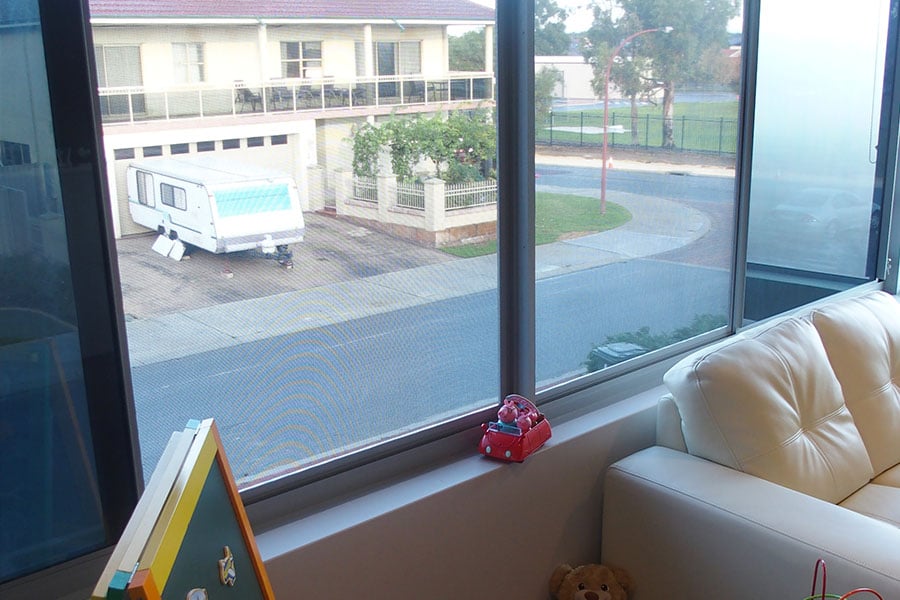
Where is `chalkboard`? chalkboard is located at coordinates pos(205,546), pos(612,349).